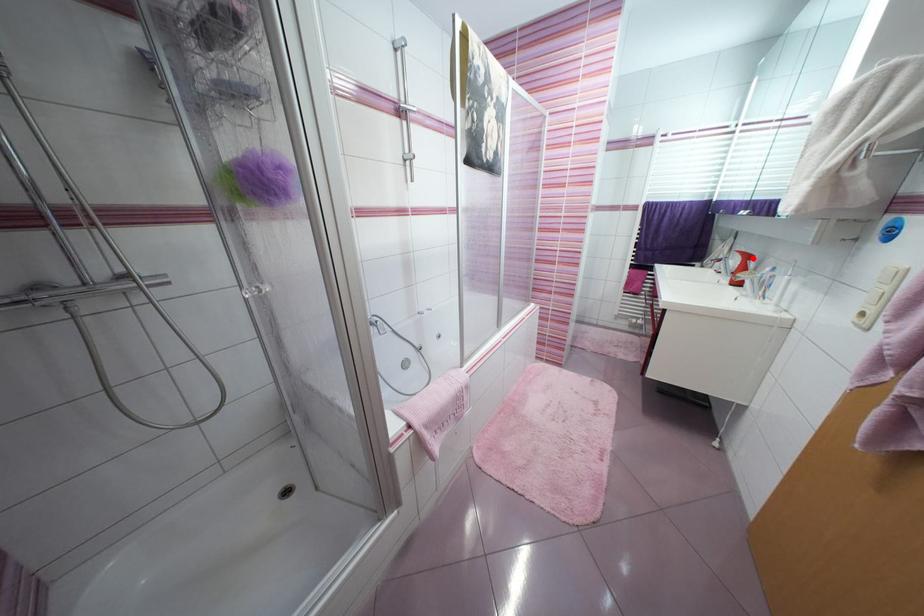
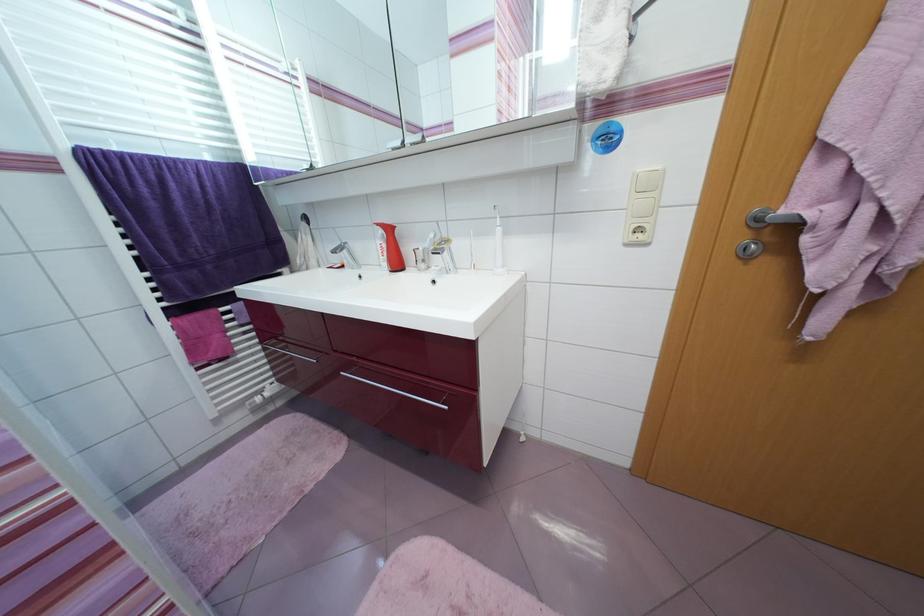
In the second image, find the point that corresponds to the highlighted location in the first image.

(394, 231)